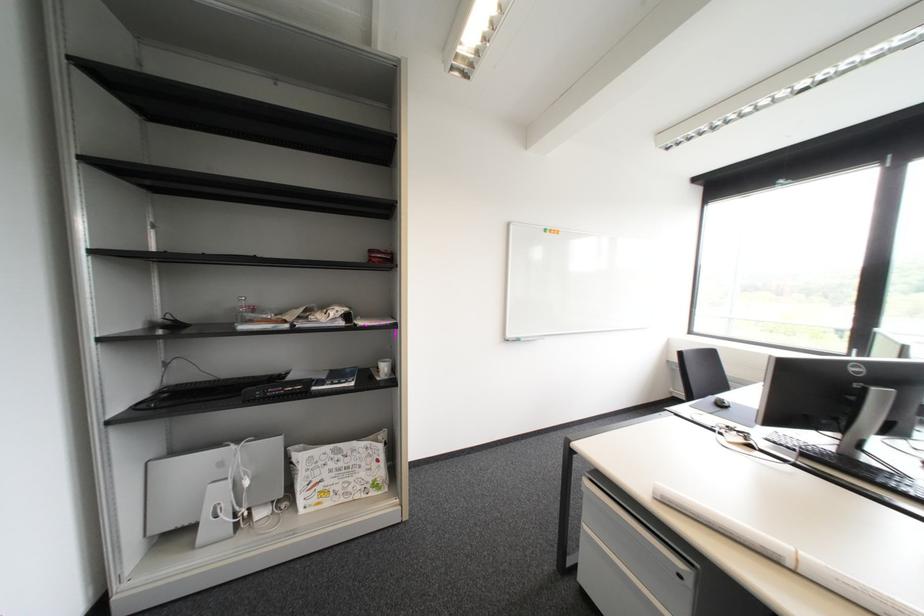
Find where to pull the cabinet drawer handle. Please return your answer as a coordinate pair (x, y).

(637, 511)